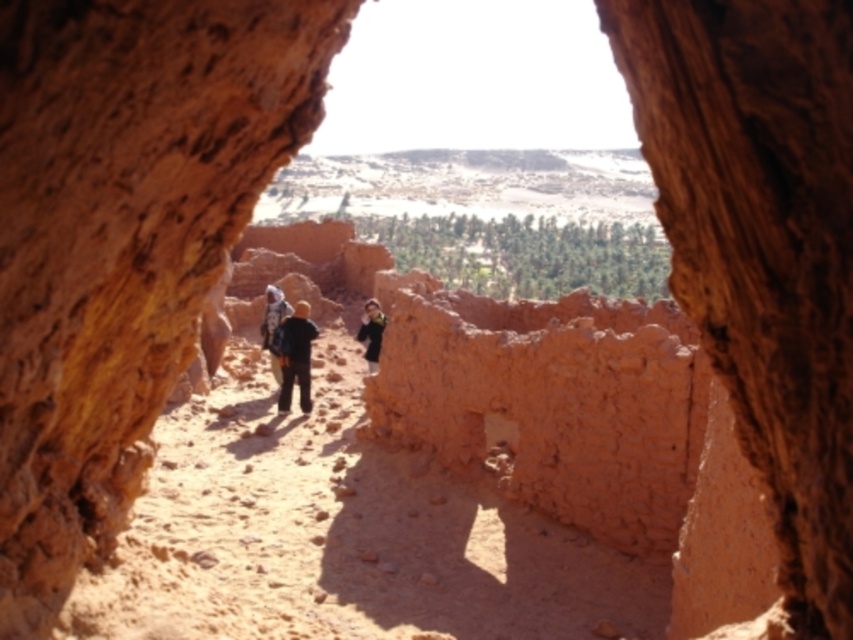
You are a hiker carrying both the dark brown leather jacket at center and the matte brown backpack at center. You want to place them side by side on the sandy ground in the desert. Which item will take up more space horizontally?

The matte brown backpack at center has a greater width than the dark brown leather jacket at center, so it will take up more horizontal space.